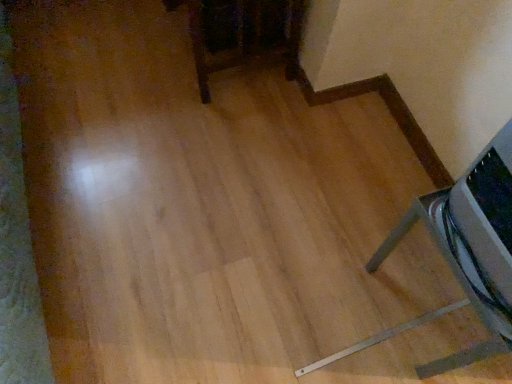
Find the location of a particular element. vacant space that is to the left of metallic silver speaker at lower right, arranged as the first furniture when viewed from the right is located at coordinates (334, 291).